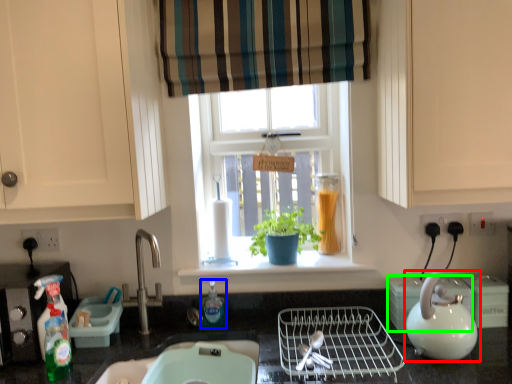
Question: Considering the real-world distances, which object is closest to kettle (highlighted by a red box)? bottle (highlighted by a blue box) or appliance (highlighted by a green box).

Choices:
 (A) bottle
 (B) appliance

Answer: (B)